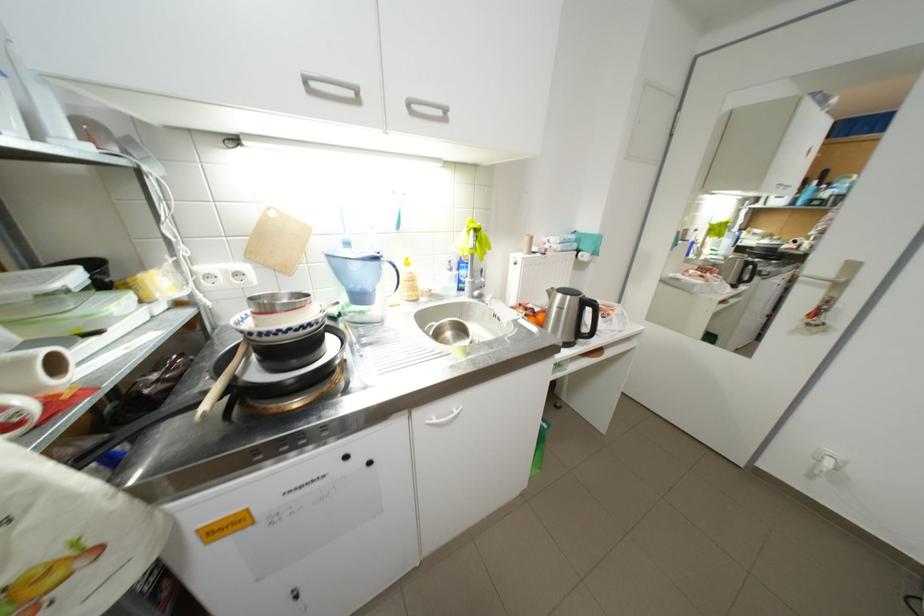
Where is `white cabinet handle`? This screenshot has width=924, height=616. white cabinet handle is located at coordinates (444, 418).